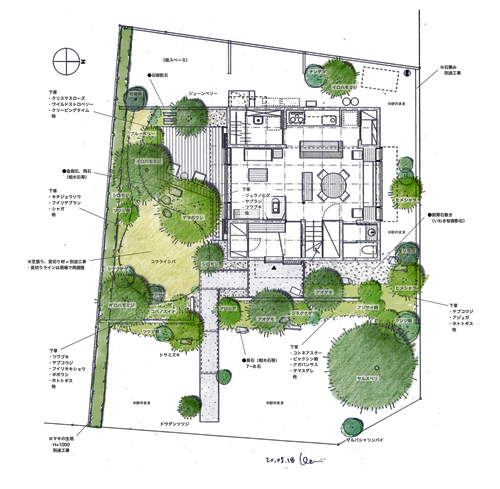
You are a GUI agent. You are given a task and a screenshot of the screen. Output one action in this format:
    pyautogui.click(x=<x>, y=<y>)
    Task: Click on the rug
    The width and height of the screenshot is (500, 489).
    Given the screenshot: What is the action you would take?
    pyautogui.click(x=309, y=153)